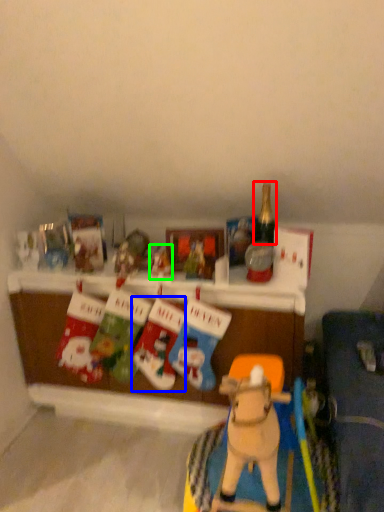
Question: Based on their relative distances, which object is nearer to bottle (highlighted by a red box)? Choose from toy (highlighted by a blue box) and toy (highlighted by a green box).

Choices:
 (A) toy
 (B) toy

Answer: (B)